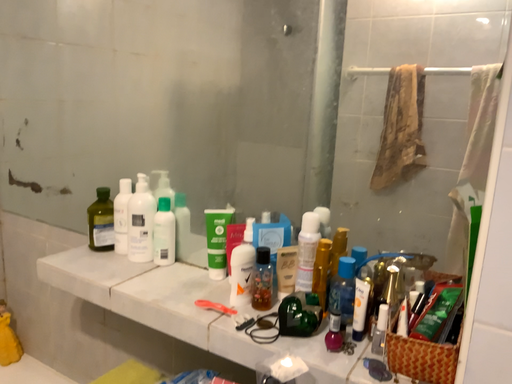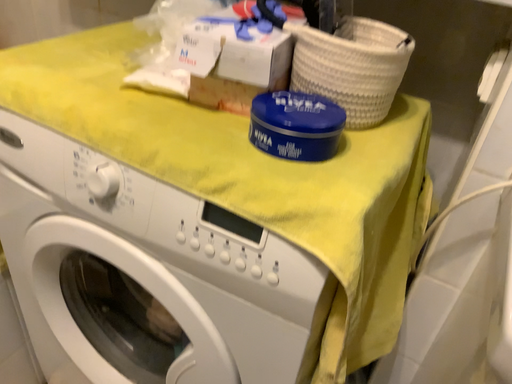
Question: Which way did the camera rotate in the video?

Choices:
 (A) rotated upward
 (B) rotated downward

Answer: (B)